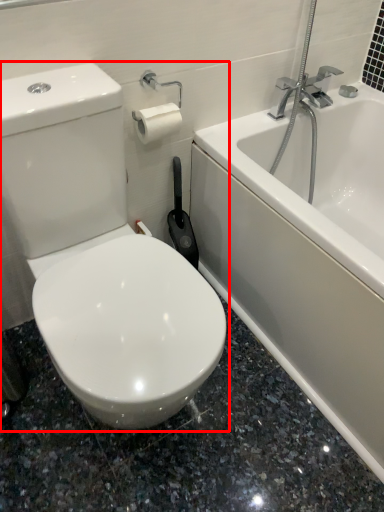
Question: From the image's perspective, what is the correct spatial positioning of toilet (annotated by the red box) in reference to bathtub?

Choices:
 (A) below
 (B) above

Answer: (A)